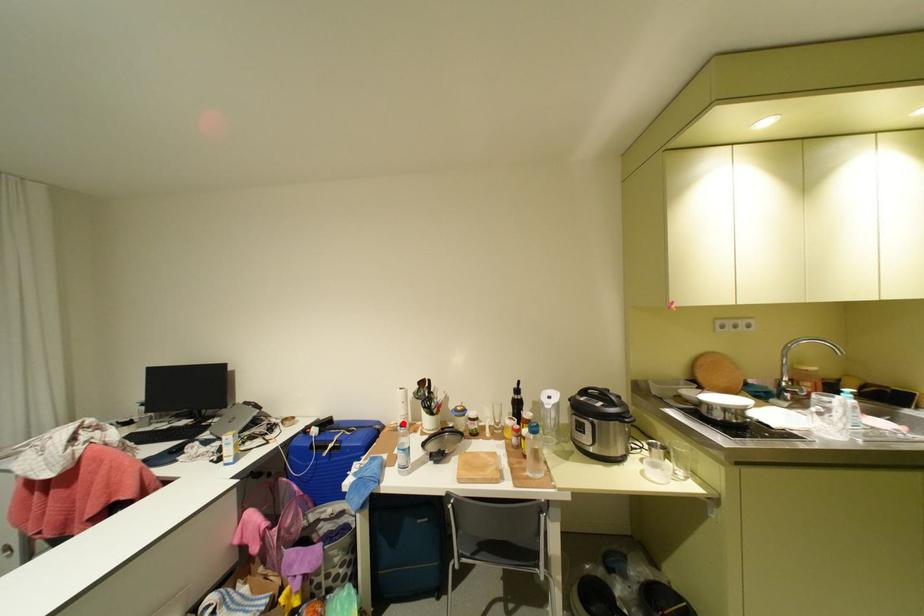
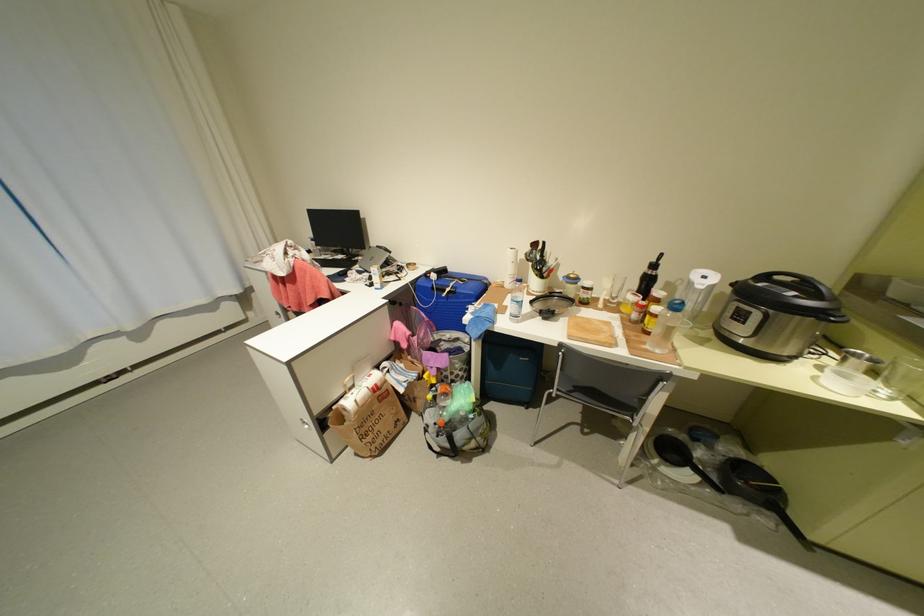
The point at the highlighted location is marked in the first image. Where is the corresponding point in the second image?

(508, 282)